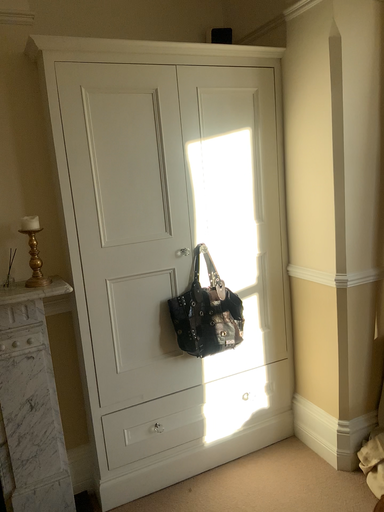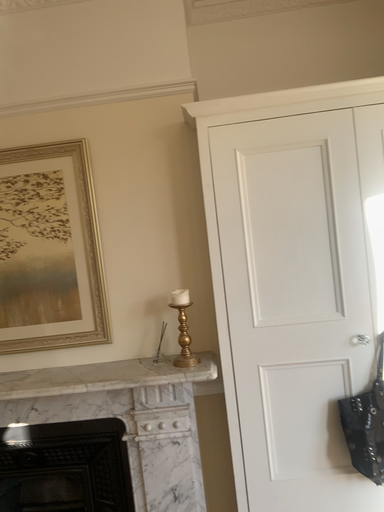
Question: Which way did the camera rotate in the video?

Choices:
 (A) rotated right
 (B) rotated left

Answer: (B)